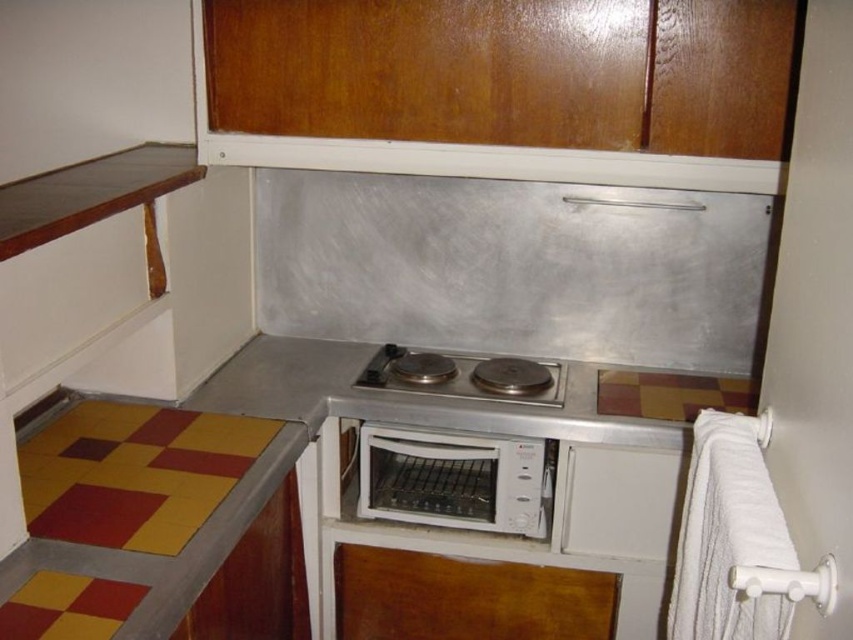
Question: Does white plastic toaster oven at center have a lesser width compared to stainless steel cooktop at center?

Choices:
 (A) yes
 (B) no

Answer: (A)

Question: Can you confirm if white plastic toaster oven at center is smaller than stainless steel cooktop at center?

Choices:
 (A) no
 (B) yes

Answer: (A)

Question: Among these points, which one is nearest to the camera?

Choices:
 (A) (280, 384)
 (B) (477, 529)
 (C) (374, 376)

Answer: (B)

Question: Can you confirm if stainless steel countertop at center is positioned above white plastic toaster oven at center?

Choices:
 (A) no
 (B) yes

Answer: (B)

Question: Which of the following is the farthest from the observer?

Choices:
 (A) (383, 381)
 (B) (213, 392)
 (C) (498, 440)

Answer: (A)

Question: Among these points, which one is nearest to the camera?

Choices:
 (A) (477, 356)
 (B) (527, 525)
 (C) (585, 419)

Answer: (C)